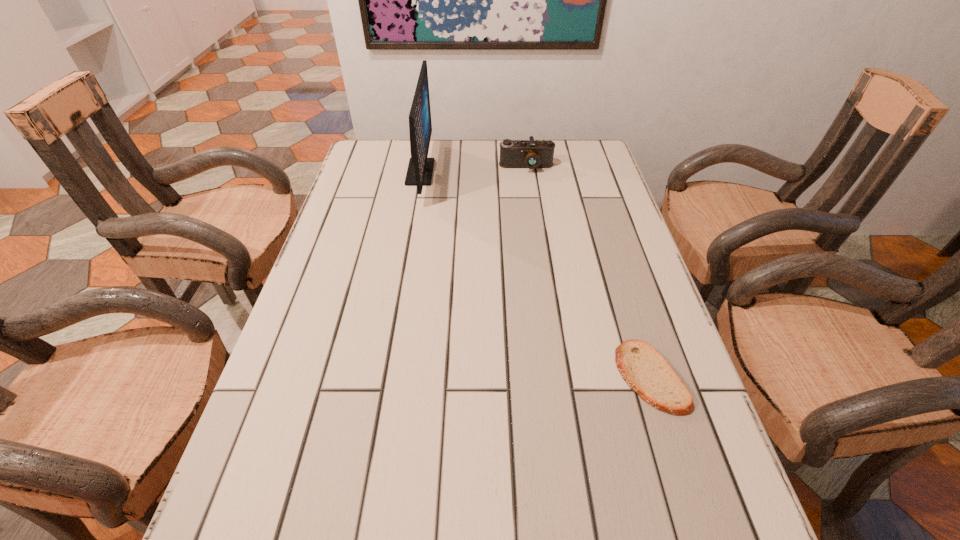
Where is `free space in the image that satisfies the following two spatial constraints: 1. on the lens of the second object from right to left; 2. on the screen side of the leftmost object`? This screenshot has height=540, width=960. free space in the image that satisfies the following two spatial constraints: 1. on the lens of the second object from right to left; 2. on the screen side of the leftmost object is located at coordinates [527, 172].

Find the location of a particular element. free spot that satisfies the following two spatial constraints: 1. on the lens of the second shortest object; 2. on the screen side of the computer monitor is located at coordinates (527, 172).

You are a GUI agent. You are given a task and a screenshot of the screen. Output one action in this format:
    pyautogui.click(x=<x>, y=<y>)
    Task: Click on the free spot that satisfies the following two spatial constraints: 1. on the back side of the nearest object; 2. on the screen side of the tallest object
    This screenshot has width=960, height=540.
    Given the screenshot: What is the action you would take?
    pyautogui.click(x=586, y=172)

Find the location of a particular element. This screenshot has height=540, width=960. vacant space that satisfies the following two spatial constraints: 1. on the lens of the shortest object; 2. on the left side of the second tallest object is located at coordinates (556, 377).

At what (x,y) coordinates should I click in order to perform the action: click on free space that satisfies the following two spatial constraints: 1. on the lens of the second tallest object; 2. on the screen side of the computer monitor. Please return your answer as a coordinate pair (x, y). Image resolution: width=960 pixels, height=540 pixels. Looking at the image, I should click on (527, 172).

The image size is (960, 540). What are the coordinates of `free location that satisfies the following two spatial constraints: 1. on the screen side of the nearest object; 2. on the right side of the leftmost object` in the screenshot? It's located at (384, 377).

Where is `free region that satisfies the following two spatial constraints: 1. on the screen side of the tallest object; 2. on the left side of the shortest object`? This screenshot has height=540, width=960. free region that satisfies the following two spatial constraints: 1. on the screen side of the tallest object; 2. on the left side of the shortest object is located at coordinates (384, 377).

Locate an element on the screen. Image resolution: width=960 pixels, height=540 pixels. vacant space that satisfies the following two spatial constraints: 1. on the screen side of the pita bread; 2. on the right side of the tallest object is located at coordinates (384, 377).

Find the location of a particular element. This screenshot has width=960, height=540. free space that satisfies the following two spatial constraints: 1. on the lens of the rightmost object; 2. on the right side of the camera is located at coordinates (556, 377).

Where is `free spot that satisfies the following two spatial constraints: 1. on the back side of the shortest object; 2. on the screen side of the tallest object`? The height and width of the screenshot is (540, 960). free spot that satisfies the following two spatial constraints: 1. on the back side of the shortest object; 2. on the screen side of the tallest object is located at coordinates (586, 172).